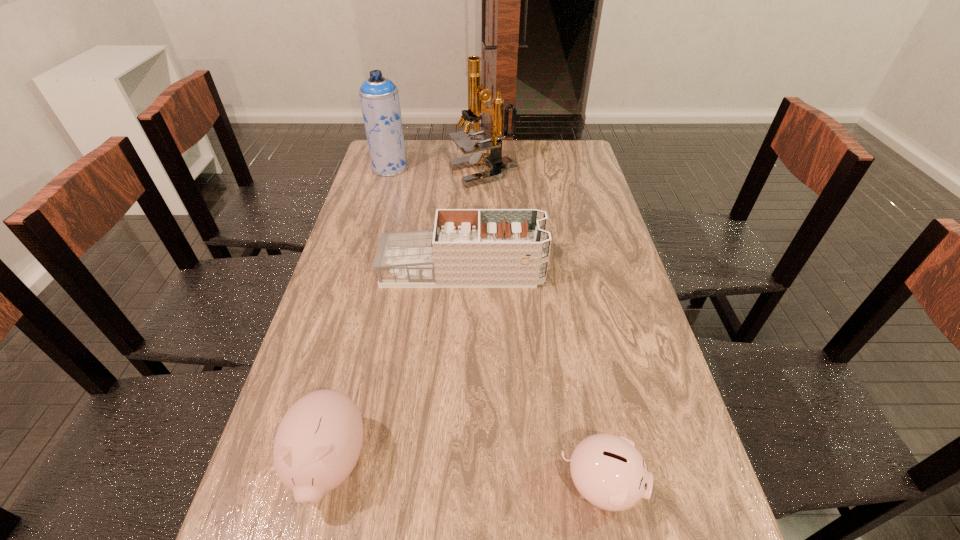
At what (x,y) coordinates should I click in order to perform the action: click on empty space between the aerosol can and the shorter piggy bank. Please return your answer as a coordinate pair (x, y). Looking at the image, I should click on (495, 327).

Where is `free spot between the shorter piggy bank and the left piggy bank`? Image resolution: width=960 pixels, height=540 pixels. free spot between the shorter piggy bank and the left piggy bank is located at coordinates (466, 475).

Select which object appears as the fourth closest to the third farthest object. Please provide its 2D coordinates. Your answer should be formatted as a tuple, i.e. [(x, y)], where the tuple contains the x and y coordinates of a point satisfying the conditions above.

[(609, 472)]

I want to click on object that is the second closest to the microscope, so click(468, 248).

The width and height of the screenshot is (960, 540). In order to click on free spot that satisfies the following two spatial constraints: 1. at the snout of the shorter piggy bank; 2. on the left side of the left piggy bank in this screenshot , I will do `click(324, 486)`.

I want to click on vacant region that satisfies the following two spatial constraints: 1. at the entrance of the right piggy bank; 2. on the left side of the third farthest object, so click(x=453, y=486).

What are the coordinates of `free space in the image that satisfies the following two spatial constraints: 1. at the snout of the right piggy bank; 2. on the right side of the left piggy bank` in the screenshot? It's located at (324, 486).

Where is `free spot that satisfies the following two spatial constraints: 1. at the snout of the shortest object; 2. on the right side of the taller piggy bank`? The height and width of the screenshot is (540, 960). free spot that satisfies the following two spatial constraints: 1. at the snout of the shortest object; 2. on the right side of the taller piggy bank is located at coordinates (324, 486).

This screenshot has height=540, width=960. In order to click on vacant space that satisfies the following two spatial constraints: 1. at the eyepiece of the microscope; 2. on the back side of the shortest object in this screenshot , I will do `click(488, 486)`.

The height and width of the screenshot is (540, 960). What are the coordinates of `free location that satisfies the following two spatial constraints: 1. at the entrance of the shortest object; 2. on the left side of the third nearest object` in the screenshot? It's located at (453, 486).